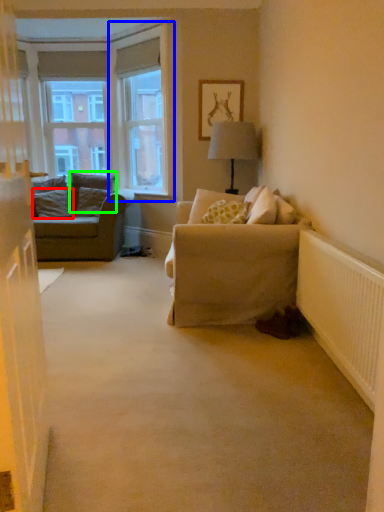
Question: Estimate the real-world distances between objects in this image. Which object is closer to pillow (highlighted by a red box), window frame (highlighted by a blue box) or pillow (highlighted by a green box)?

Choices:
 (A) window frame
 (B) pillow

Answer: (B)